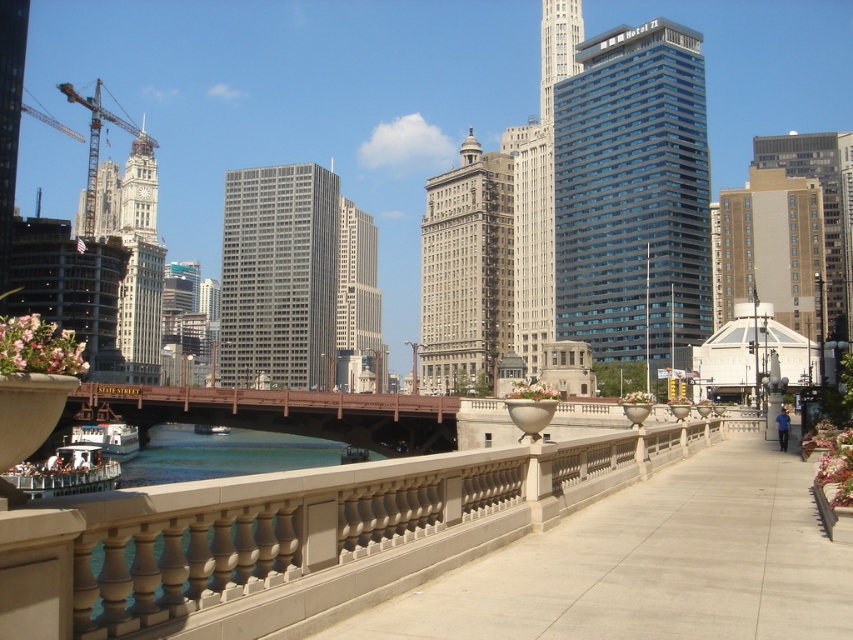
The width and height of the screenshot is (853, 640). In order to click on matte gray skyscraper at left in this screenshot , I will do `click(140, 266)`.

Does matte gray skyscraper at left have a lesser height compared to silver glass skyscraper at center?

No, matte gray skyscraper at left is not shorter than silver glass skyscraper at center.

Where is `matte gray skyscraper at left`? matte gray skyscraper at left is located at coordinates (140, 266).

This screenshot has width=853, height=640. What are the coordinates of `matte gray skyscraper at left` in the screenshot? It's located at (140, 266).

Between point (628, 552) and point (258, 220), which one is positioned in front?

Point (628, 552)

Can you confirm if smooth concrete pavement at center is smaller than gray concrete skyscraper at center?

Yes.

Describe the element at coordinates (651, 564) in the screenshot. I see `smooth concrete pavement at center` at that location.

Where is `smooth concrete pavement at center`? Image resolution: width=853 pixels, height=640 pixels. smooth concrete pavement at center is located at coordinates (651, 564).

Which of these two, smooth concrete pavement at center or blue glass building at center, stands shorter?

smooth concrete pavement at center

Who is more forward, (563,598) or (608,205)?

Positioned in front is point (563,598).

Who is more forward, (817, 589) or (630, 100)?

Positioned in front is point (817, 589).

Image resolution: width=853 pixels, height=640 pixels. Identify the location of smooth concrete pavement at center. (651, 564).